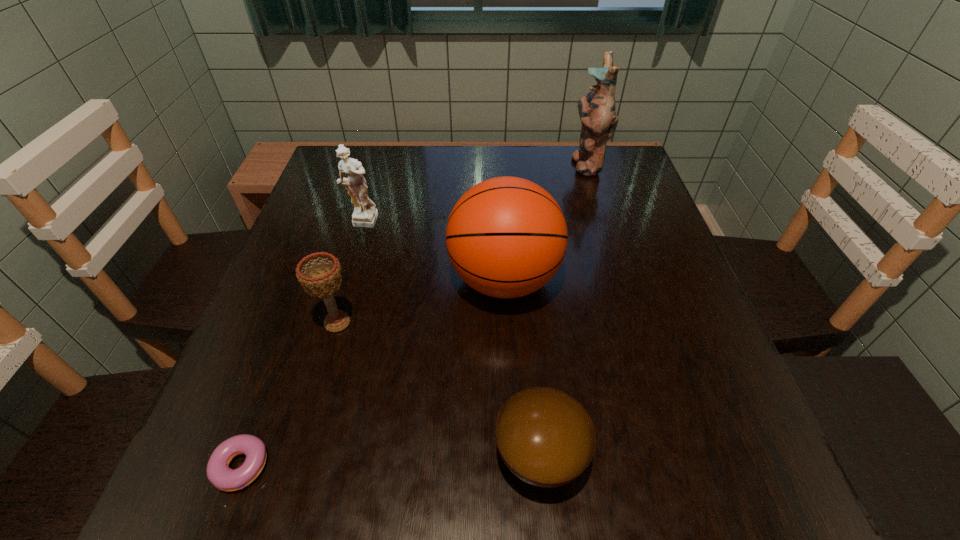
Image resolution: width=960 pixels, height=540 pixels. Identify the location of free space that satisfies the following two spatial constraints: 1. on the front-facing side of the fifth tallest object; 2. on the left side of the second farthest object. (293, 455).

Where is `free space that satisfies the following two spatial constraints: 1. on the front-facing side of the farthest object; 2. on the front-facing side of the second farthest object`? The width and height of the screenshot is (960, 540). free space that satisfies the following two spatial constraints: 1. on the front-facing side of the farthest object; 2. on the front-facing side of the second farthest object is located at coordinates (604, 222).

Where is `vacant area that satisfies the following two spatial constraints: 1. on the front-facing side of the shorter figurine; 2. on the right side of the second shortest object`? Image resolution: width=960 pixels, height=540 pixels. vacant area that satisfies the following two spatial constraints: 1. on the front-facing side of the shorter figurine; 2. on the right side of the second shortest object is located at coordinates (293, 455).

The width and height of the screenshot is (960, 540). Find the location of `free location that satisfies the following two spatial constraints: 1. on the front side of the bowl; 2. on the left side of the basketball`. free location that satisfies the following two spatial constraints: 1. on the front side of the bowl; 2. on the left side of the basketball is located at coordinates (513, 455).